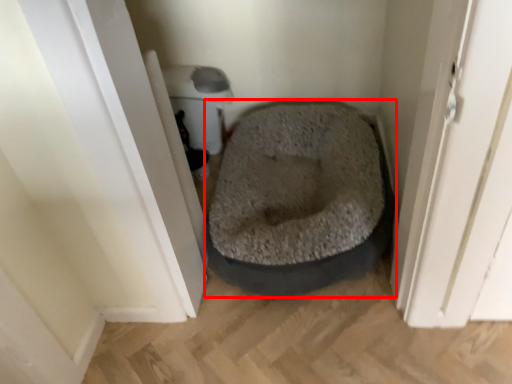
Question: From the image's perspective, where is dog bed (annotated by the red box) located relative to screen door?

Choices:
 (A) above
 (B) below

Answer: (B)